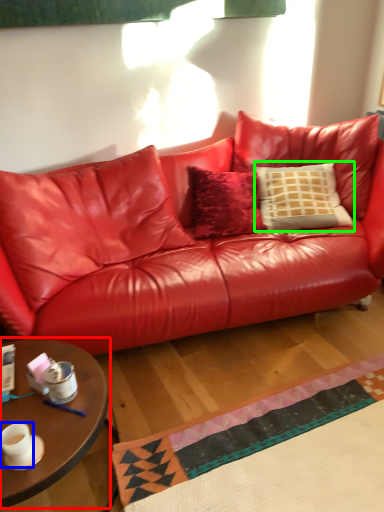
Question: Which object is the closest to the coffee table (highlighted by a red box)? Choose among these: coffee cup (highlighted by a blue box) or pillow (highlighted by a green box).

Choices:
 (A) coffee cup
 (B) pillow

Answer: (A)